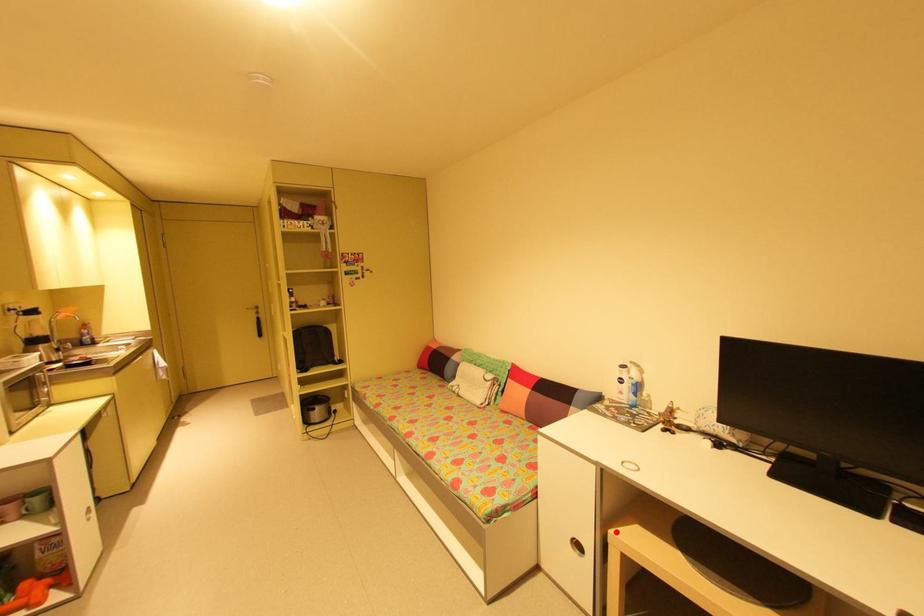
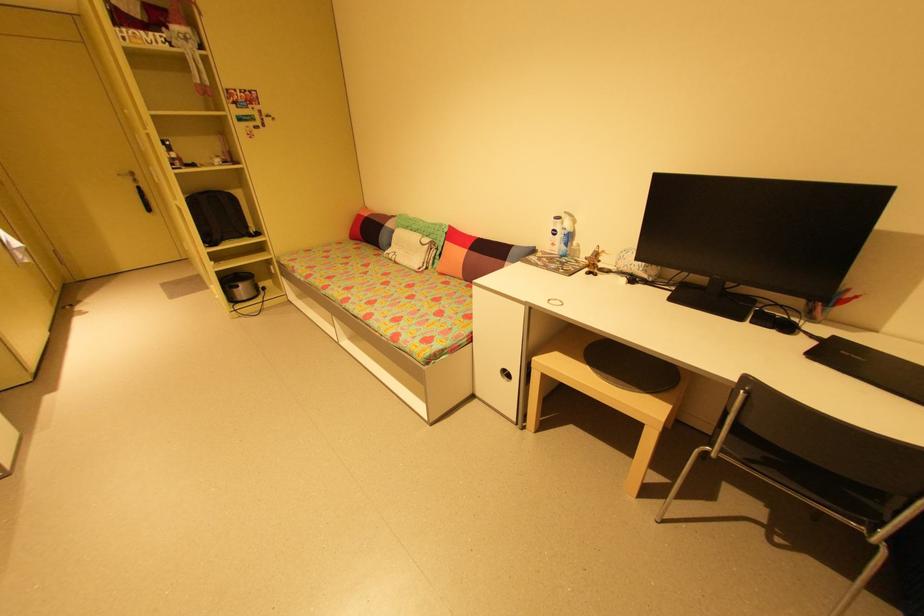
Where in the second image is the point corresponding to the highlighted location from the first image?

(540, 359)